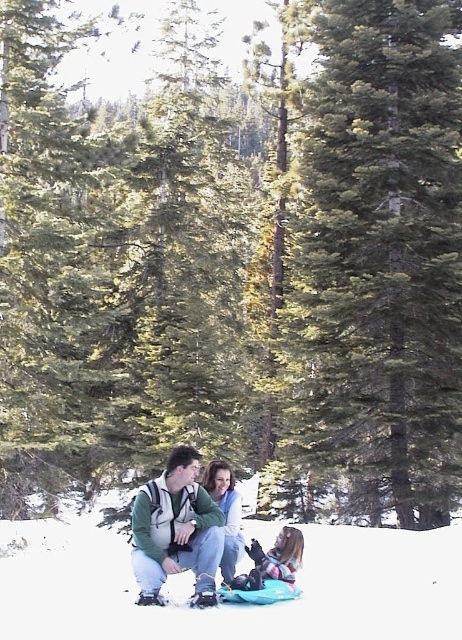
Can you confirm if green textured pine tree at center is positioned above green fleece jacket at center?

Correct, green textured pine tree at center is located above green fleece jacket at center.

Who is higher up, green textured pine tree at center or green fleece jacket at center?

green textured pine tree at center is above.

Locate an element on the screen. Image resolution: width=462 pixels, height=640 pixels. green textured pine tree at center is located at coordinates (380, 260).

Who is lower down, green fleece jacket at center or soft pink fabric at lower center?

Positioned lower is soft pink fabric at lower center.

Is point (214, 586) positioned in front of point (269, 572)?

That is True.

Find the location of `green fleece jacket at center`. green fleece jacket at center is located at coordinates (176, 531).

Is green textured pine tree at center closer to the viewer compared to soft pink fabric at lower center?

No, it is not.

Who is more forward, (x=419, y=282) or (x=290, y=544)?

Positioned in front is point (x=290, y=544).

Locate an element on the screen. green textured pine tree at center is located at coordinates (380, 260).

What are the coordinates of `green textured pine tree at center` in the screenshot? It's located at (380, 260).